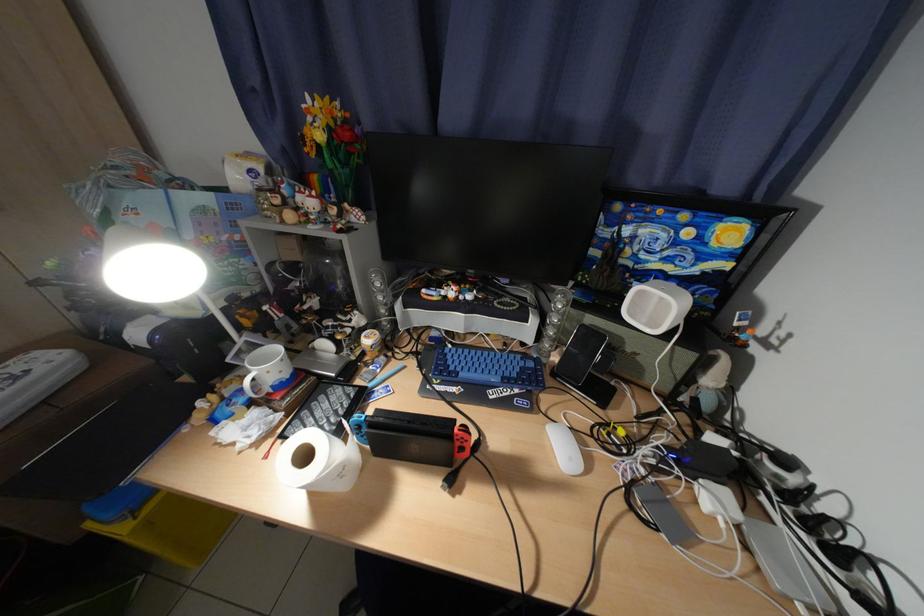
What do you see at coordinates (553, 328) in the screenshot? I see `a speaker volume dial` at bounding box center [553, 328].